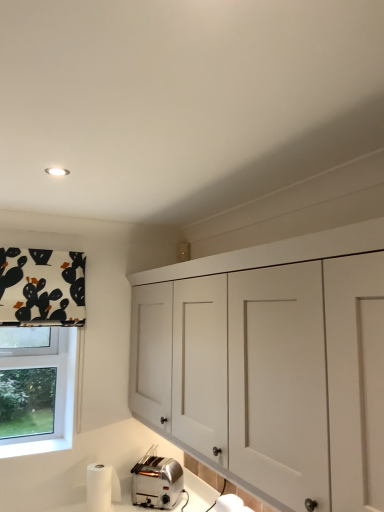
Question: Considering the positions of white matte cabinet at upper center and satin silver toaster at lower left in the image, is white matte cabinet at upper center wider or thinner than satin silver toaster at lower left?

Choices:
 (A) wide
 (B) thin

Answer: (A)

Question: From the image's perspective, relative to satin silver toaster at lower left, is white matte cabinet at upper center above or below?

Choices:
 (A) below
 (B) above

Answer: (B)

Question: Which object is positioned closest to the white fabric with black and orange shapes at upper left?

Choices:
 (A) white matte cabinet at upper center
 (B) satin silver toaster at lower left

Answer: (A)

Question: Based on their relative distances, which object is nearer to the white fabric with black and orange shapes at upper left?

Choices:
 (A) satin silver toaster at lower left
 (B) white matte cabinet at upper center

Answer: (B)